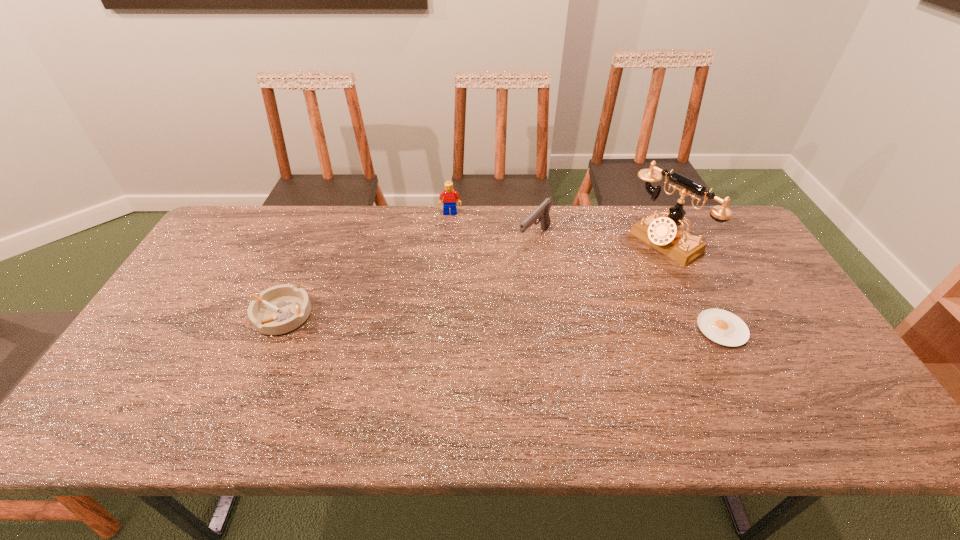
At what (x,y) coordinates should I click in order to perform the action: click on telephone that is positioned at the far edge. Please return your answer as a coordinate pair (x, y). Looking at the image, I should click on (666, 234).

You are a GUI agent. You are given a task and a screenshot of the screen. Output one action in this format:
    pyautogui.click(x=<x>, y=<y>)
    Task: Click on the vacant region at the far edge of the desktop
    
    Given the screenshot: What is the action you would take?
    pyautogui.click(x=416, y=241)

Where is `vacant space at the near edge of the desktop`? vacant space at the near edge of the desktop is located at coordinates (637, 383).

In the image, there is a desktop. Where is `vacant region at the left edge`? The height and width of the screenshot is (540, 960). vacant region at the left edge is located at coordinates (207, 260).

Locate an element on the screen. This screenshot has height=540, width=960. free space at the right edge is located at coordinates (790, 325).

The width and height of the screenshot is (960, 540). What are the coordinates of `vacant region at the near left corner of the desktop` in the screenshot? It's located at (113, 390).

You are a GUI agent. You are given a task and a screenshot of the screen. Output one action in this format:
    pyautogui.click(x=<x>, y=<y>)
    Task: Click on the free space between the tallest object and the leftmost object
    The height and width of the screenshot is (540, 960).
    Given the screenshot: What is the action you would take?
    pyautogui.click(x=473, y=278)

At what (x,y) coordinates should I click in order to perform the action: click on vacant area that lies between the egg yolk and the ashtray. Please return your answer as a coordinate pair (x, y). The image size is (960, 540). Looking at the image, I should click on coord(502,321).

This screenshot has height=540, width=960. Identify the location of free space between the ashtray and the egg yolk. (502, 321).

Find the location of a particular element. free space between the leftmost object and the shortest object is located at coordinates [502, 321].